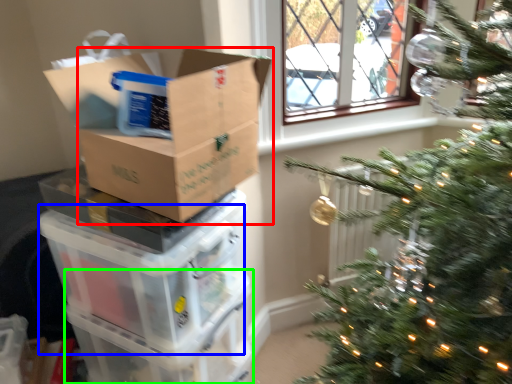
Question: Which is farther away from cardboard box (highlighted by a red box)? storage box (highlighted by a blue box) or glass box (highlighted by a green box)?

Choices:
 (A) storage box
 (B) glass box

Answer: (B)